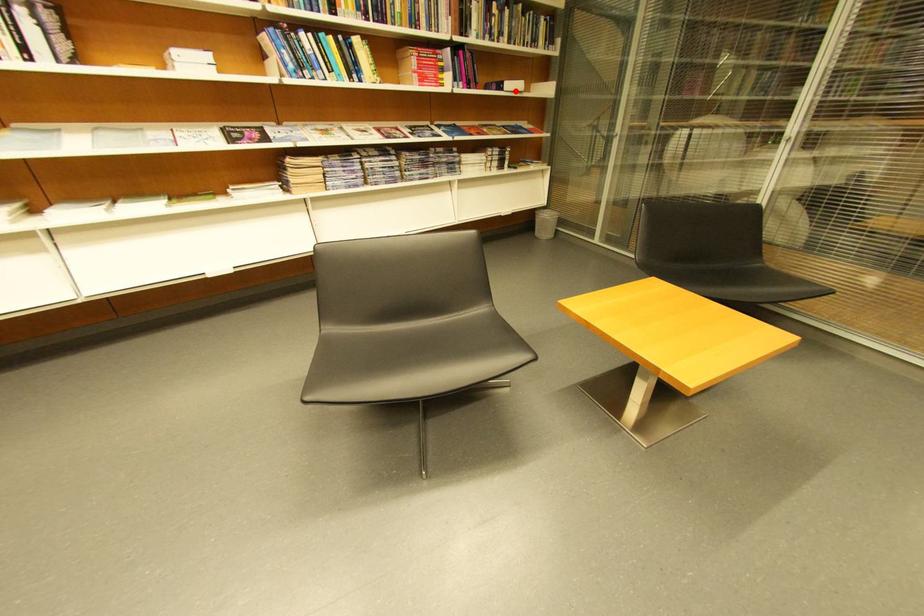
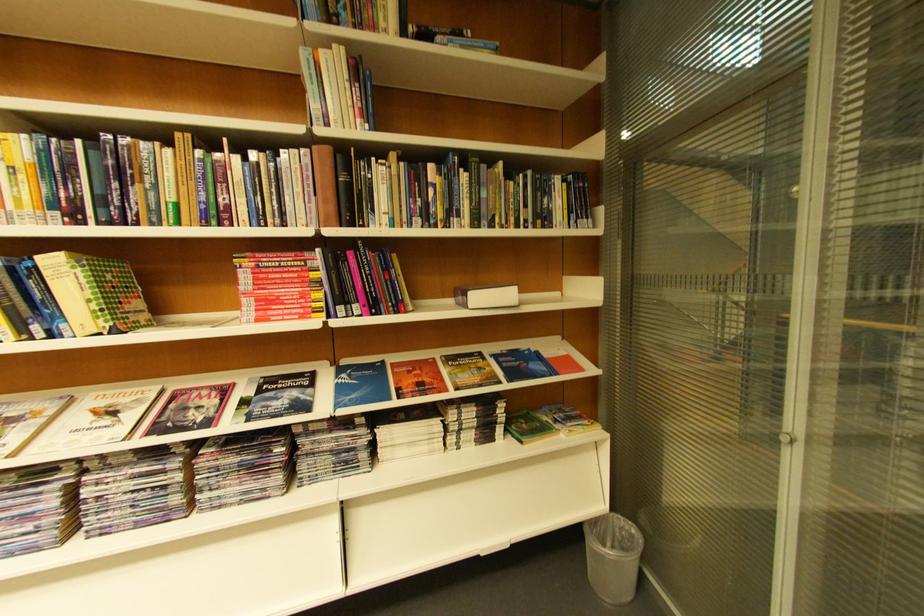
Where in the second image is the point corresponding to the highlighted location from the first image?

(480, 309)